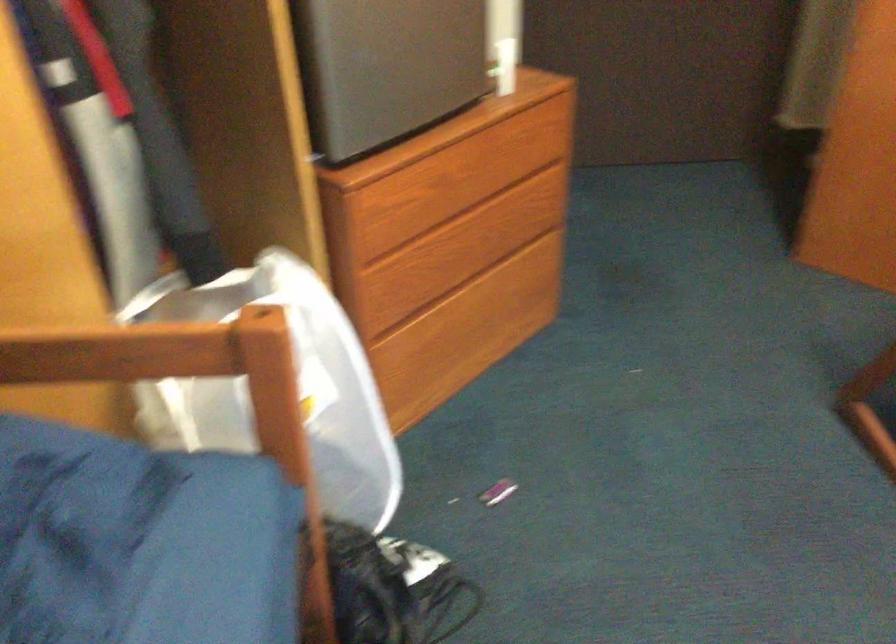
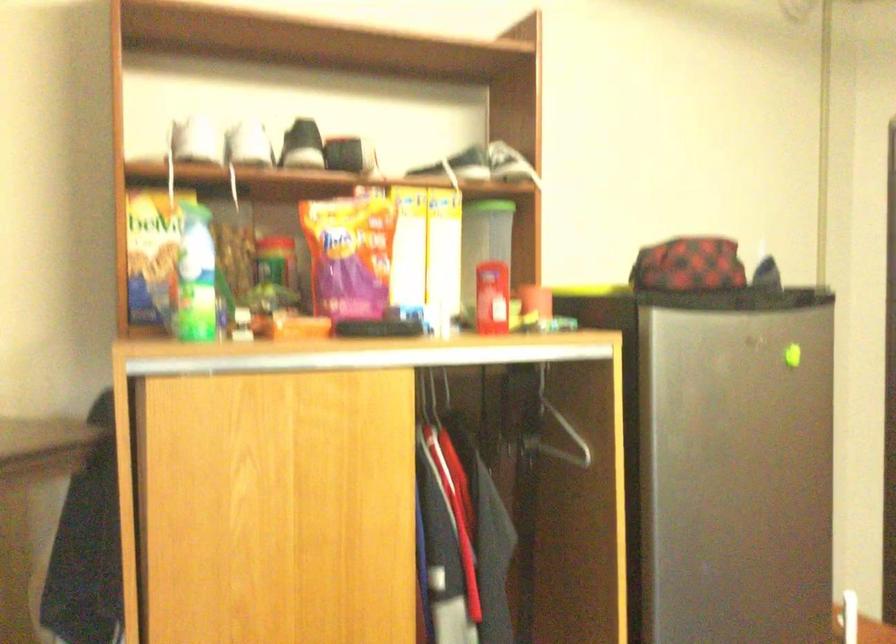
First-person continuous shooting, in which direction is the camera rotating?

The camera rotated toward left-up.